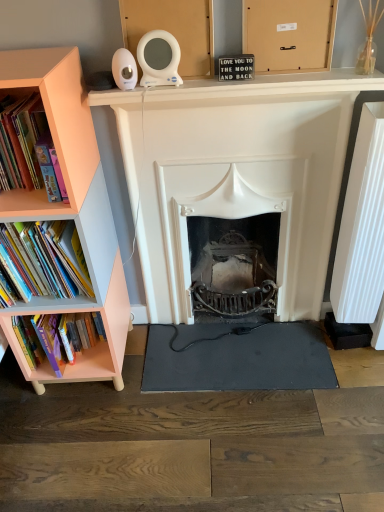
At what (x,y) coordinates should I click in order to perform the action: click on free location to the left of matte cardboard box at upper center. Please return your answer as a coordinate pair (x, y). The image size is (384, 512). Looking at the image, I should click on (228, 79).